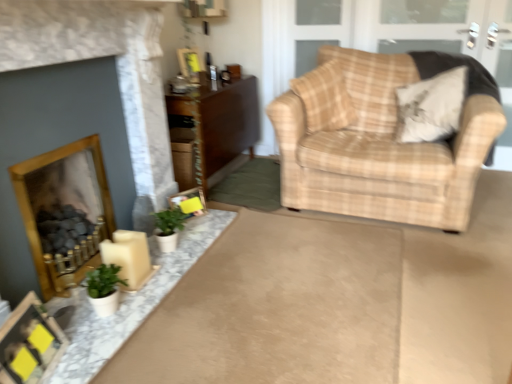
Locate an element on the screen. The width and height of the screenshot is (512, 384). blank space to the left of green matte plant at lower left, which appears as the first houseplant when viewed from the front is located at coordinates (72, 299).